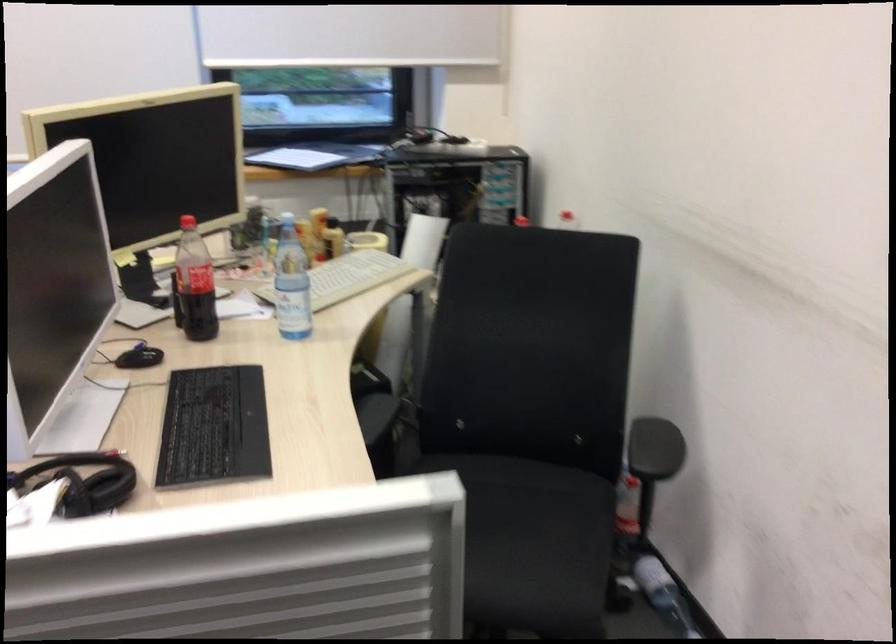
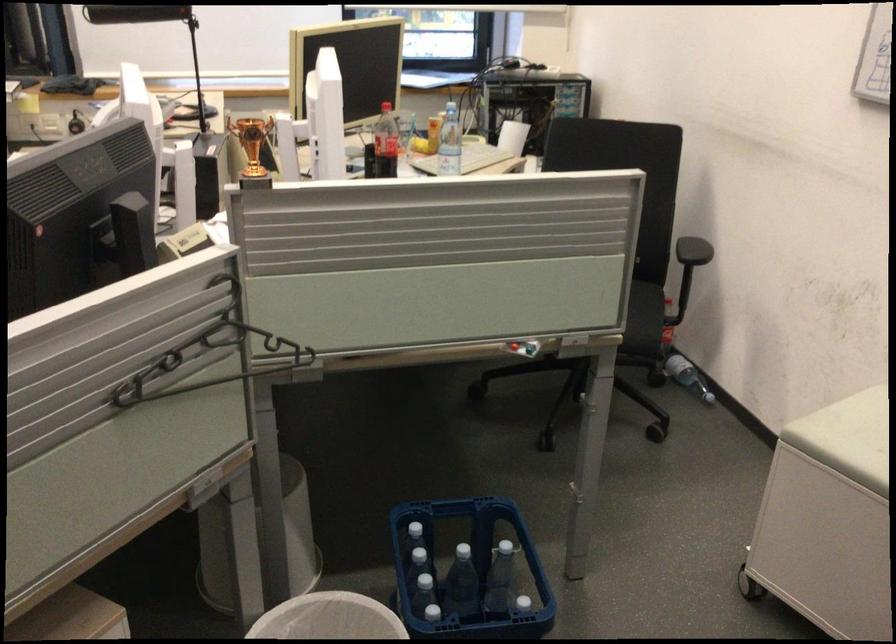
Question: I am providing you with two images of the same scene from different viewpoints. Which of the following objects are not visible in image2?

Choices:
 (A) plastic water bottle
 (B) chair sitting surface
 (C) black clothes hanger
 (D) black drawer front

Answer: (B)